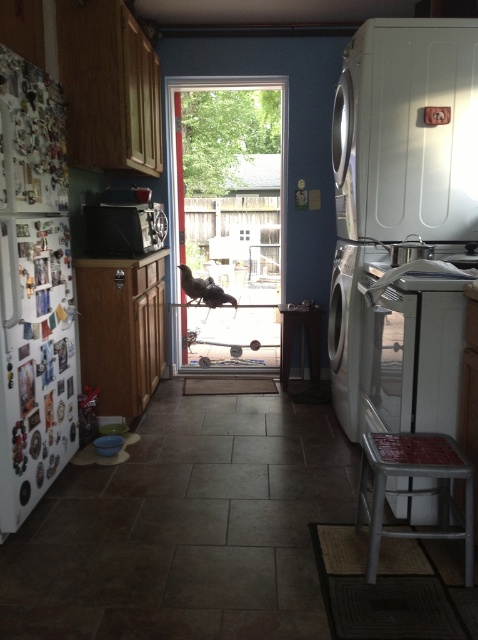
Question: Which object is positioned farthest from the white matte refrigerator at left?

Choices:
 (A) clear glass screen door at center
 (B) metallic silver microwave at center

Answer: (A)

Question: From the image, what is the correct spatial relationship of white matte washing machine at right in relation to clear glass screen door at center?

Choices:
 (A) below
 (B) above

Answer: (A)

Question: In this image, where is white matte washing machine at right located relative to metallic silver microwave at center?

Choices:
 (A) above
 (B) below

Answer: (A)

Question: Can you confirm if white matte refrigerator at left is positioned to the right of metallic silver stool at lower right?

Choices:
 (A) yes
 (B) no

Answer: (B)

Question: Which point is farther to the camera?

Choices:
 (A) metallic silver stool at lower right
 (B) white matte washing machine at right

Answer: (B)

Question: Which point is closer to the camera taking this photo?

Choices:
 (A) (106, 208)
 (B) (0, 403)

Answer: (B)